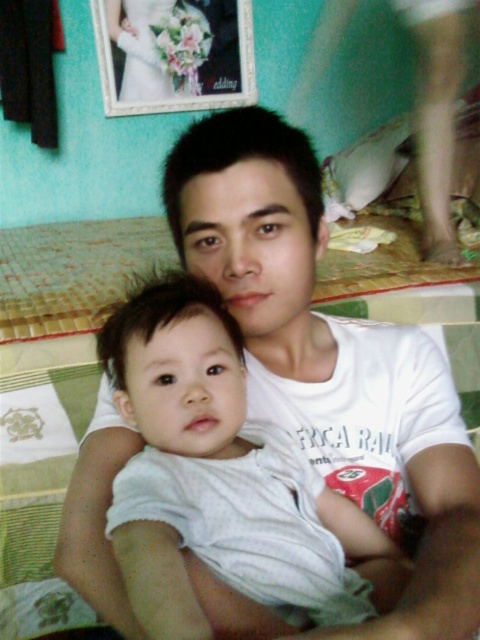
This screenshot has width=480, height=640. Describe the element at coordinates (220, 477) in the screenshot. I see `white cotton baby at center` at that location.

Is point (157, 346) closer to camera compared to point (460, 260)?

Yes, point (157, 346) is closer to viewer.

The width and height of the screenshot is (480, 640). I want to click on white cotton baby at center, so click(x=220, y=477).